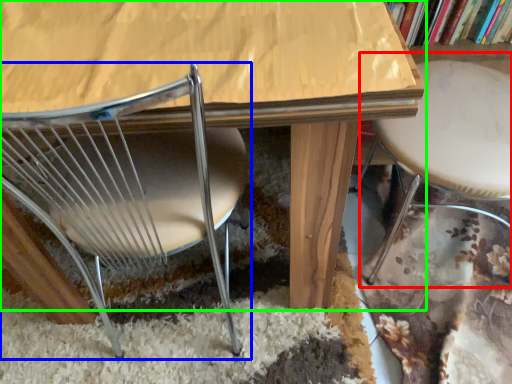
Question: Estimate the real-world distances between objects in this image. Which object is closer to bar stool (highlighted by a red box), chair (highlighted by a blue box) or table (highlighted by a green box)?

Choices:
 (A) chair
 (B) table

Answer: (B)